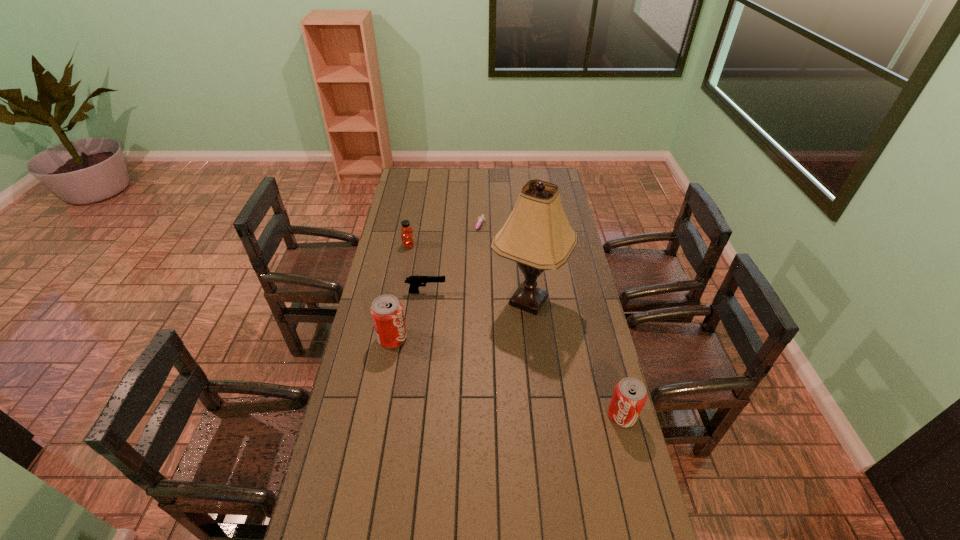
Where is `the second shortest object`? This screenshot has height=540, width=960. the second shortest object is located at coordinates (415, 282).

Image resolution: width=960 pixels, height=540 pixels. I want to click on vacant space located 0.360m on the back of the farther soda can, so click(406, 265).

You are a GUI agent. You are given a task and a screenshot of the screen. Output one action in this format:
    pyautogui.click(x=<x>, y=<y>)
    Task: Click on the vacant space located 0.050m on the back of the right soda can
    Image resolution: width=960 pixels, height=540 pixels.
    Given the screenshot: What is the action you would take?
    click(x=615, y=389)

Where is `vacant region located 0.330m on the front label of the fifth nearest object`? This screenshot has width=960, height=540. vacant region located 0.330m on the front label of the fifth nearest object is located at coordinates (485, 245).

Locate an element on the screen. vacant region located 0.280m on the front of the lamp is located at coordinates (539, 394).

In order to click on vacant region located 0.080m on the left of the third object from right to left in this screenshot , I will do `click(457, 228)`.

Where is `vacant region located on the front-facing side of the second shortest object`? The image size is (960, 540). vacant region located on the front-facing side of the second shortest object is located at coordinates (485, 292).

At what (x,y) coordinates should I click in order to perform the action: click on soda can at the left edge. Please return your answer as a coordinate pair (x, y). The height and width of the screenshot is (540, 960). Looking at the image, I should click on (386, 311).

Where is `honey that is at the left edge`? The width and height of the screenshot is (960, 540). honey that is at the left edge is located at coordinates (407, 238).

Locate an element on the screen. Image resolution: width=960 pixels, height=540 pixels. pistol present at the left edge is located at coordinates (415, 282).